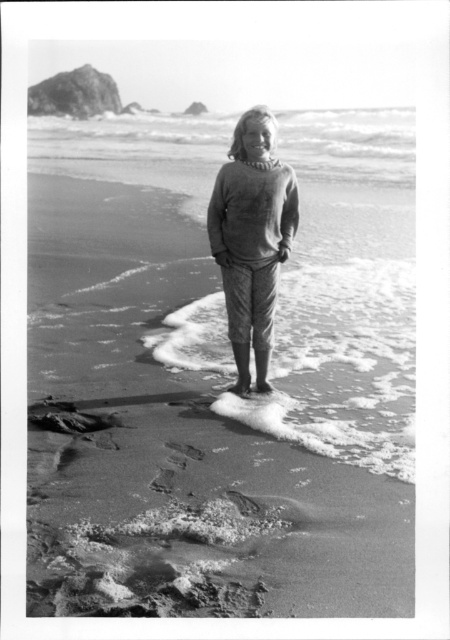
Is smooth sand at center to the left of matte gray sweater at center from the viewer's perspective?

Yes, smooth sand at center is to the left of matte gray sweater at center.

Who is positioned more to the left, smooth sand at center or matte gray sweater at center?

smooth sand at center is more to the left.

The height and width of the screenshot is (640, 450). Describe the element at coordinates (216, 401) in the screenshot. I see `smooth sand at center` at that location.

Image resolution: width=450 pixels, height=640 pixels. I want to click on smooth sand at center, so click(x=216, y=401).